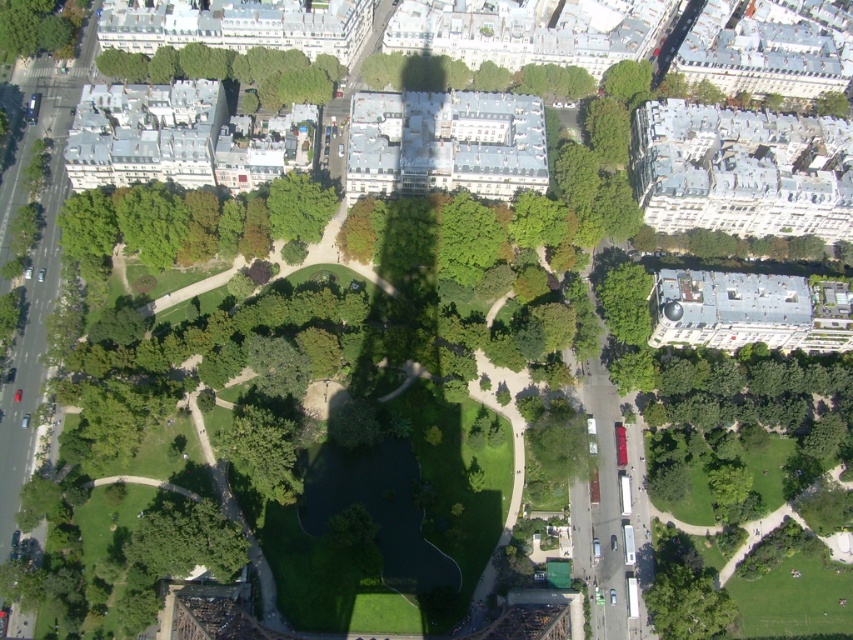
You are planning to plant a new tree in the park. You have two options for locations based on the existing trees. The first location is where the green leafy trees at center are, and the second is where the green leafy trees at upper left are. Which location currently has trees with wider trunks?

The green leafy trees at upper left have a greater width compared to the green leafy trees at center, so the second location has wider trunks.

You are a drone operator trying to capture a photo of the green leafy trees at center from above. The park has a strict rule that drones must stay at least 2 meters above the ground. Given that the trees are at point coordinates of 0.350, 0.151, can you determine if the drone can safely hover at 2 meters above the trees without violating the rule?

The green leafy trees at center are located at coordinates (x=128, y=224). Since the park requires drones to stay at least 2 meters above the ground, the drone can safely hover at 2 meters above the trees as long as the trees themselves are not taller than the minimum altitude requirement. However, the exact height of the trees isn